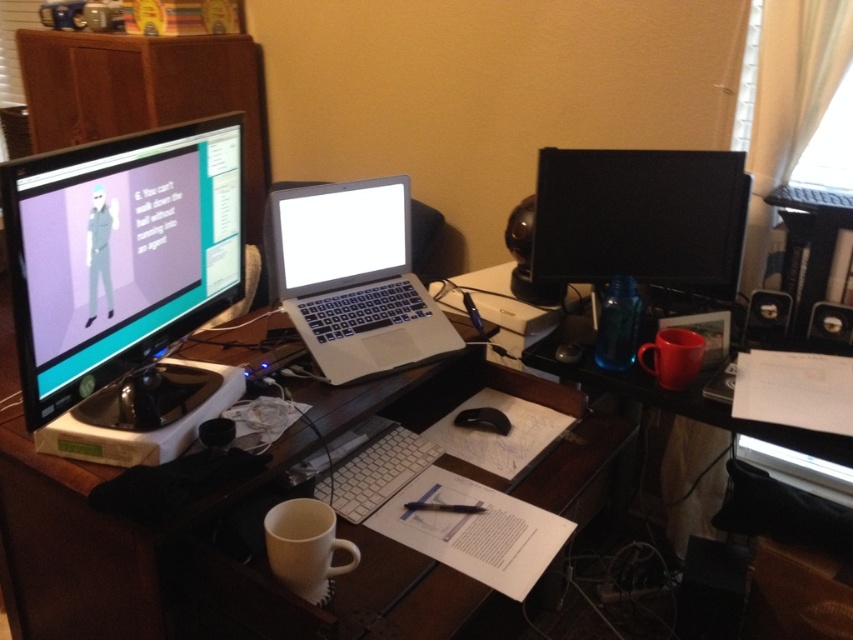
You are standing in front of the desk and want to place a small plant between the white glossy desk at center and the matte black monitor at left. Which object should you move closer to you to create space?

To create space between the white glossy desk at center and the matte black monitor at left, you should move the matte black monitor at left closer to you since the white glossy desk at center is already further away from you.

You are organizing your home office and want to move the white glossy desk at center closer to the wall. However, there is a matte black monitor at left in the way. Can you move the desk without moving the monitor first?

The white glossy desk at center is positioned under the matte black monitor at left, so you cannot move the desk closer to the wall without moving the monitor first because the desk is supporting the monitor.